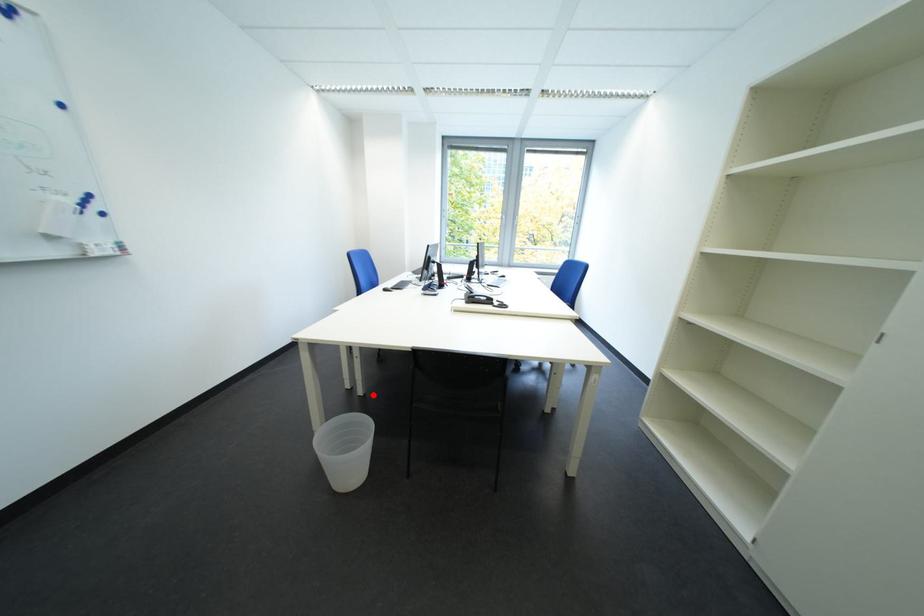
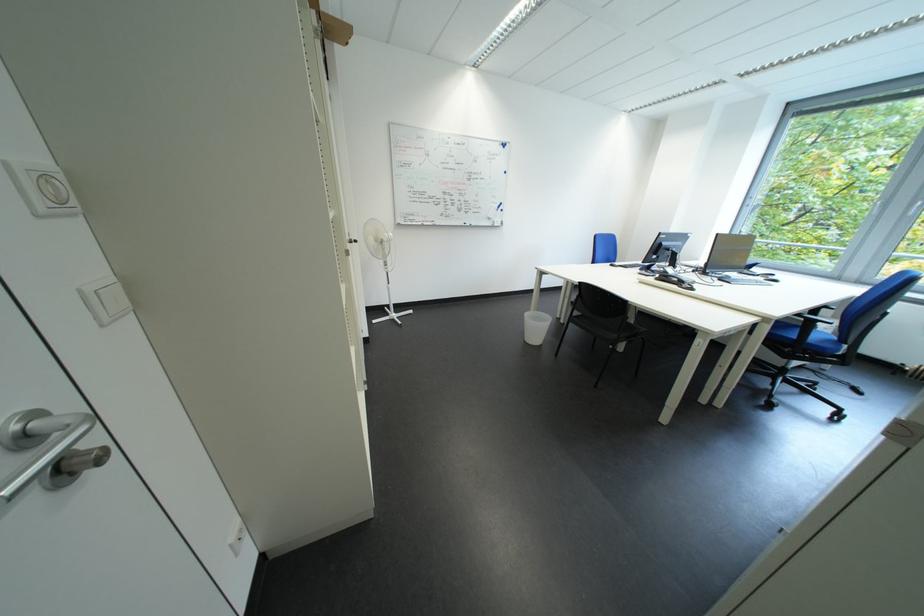
In the second image, find the point that corresponds to the highlighted location in the first image.

(575, 323)